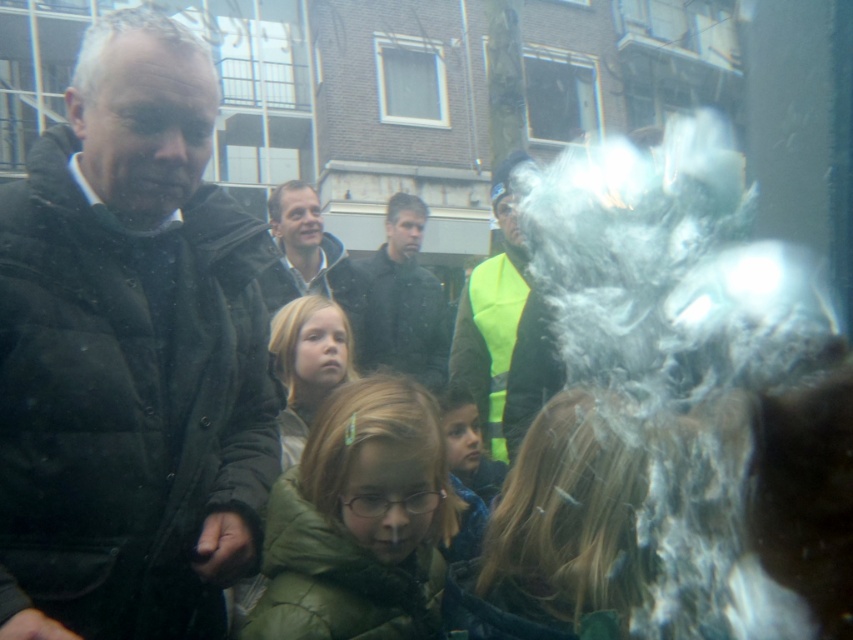
Is matte black jacket at left smaller than green fuzzy coat at center?

Actually, matte black jacket at left might be larger than green fuzzy coat at center.

Is point (132, 461) positioned after point (445, 525)?

No, (132, 461) is in front of (445, 525).

At what (x,y) coordinates should I click in order to perform the action: click on matte black jacket at left. Please return your answer as a coordinate pair (x, y). Looking at the image, I should click on (131, 355).

Who is shorter, dark green jacket at center or blonde hair at center?

With less height is blonde hair at center.

Between dark green jacket at center and blonde hair at center, which one appears on the right side from the viewer's perspective?

dark green jacket at center is more to the right.

Is point (355, 323) farther from camera compared to point (320, 362)?

Yes, point (355, 323) is farther from viewer.

Identify the location of dark green jacket at center. The width and height of the screenshot is (853, 640). (399, 301).

In order to click on dark green jacket at center in this screenshot , I will do `click(399, 301)`.

The image size is (853, 640). What do you see at coordinates (399, 301) in the screenshot? I see `dark green jacket at center` at bounding box center [399, 301].

Where is `dark green jacket at center`? Image resolution: width=853 pixels, height=640 pixels. dark green jacket at center is located at coordinates (399, 301).